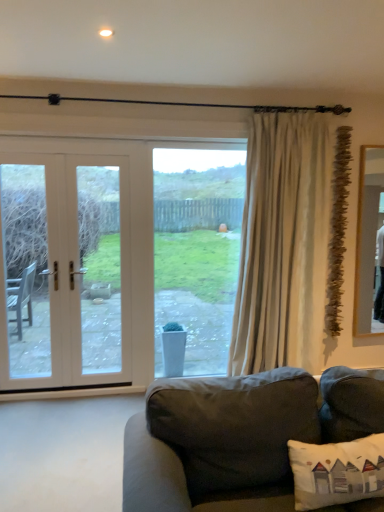
Question: Is clear glass window at center positioned in front of white wood door at left?

Choices:
 (A) no
 (B) yes

Answer: (A)

Question: Could you tell me if clear glass window at center is turned towards white wood door at left?

Choices:
 (A) yes
 (B) no

Answer: (B)

Question: Can you confirm if clear glass window at center is positioned to the right of white wood door at left?

Choices:
 (A) yes
 (B) no

Answer: (A)

Question: Considering the relative sizes of clear glass window at center and white wood door at left in the image provided, is clear glass window at center thinner than white wood door at left?

Choices:
 (A) yes
 (B) no

Answer: (A)

Question: From a real-world perspective, is clear glass window at center over white wood door at left?

Choices:
 (A) yes
 (B) no

Answer: (B)

Question: Looking at the image, does white wood door at left seem bigger or smaller compared to dark gray fabric couch at lower center?

Choices:
 (A) small
 (B) big

Answer: (A)

Question: In the image, is white wood door at left positioned in front of or behind dark gray fabric couch at lower center?

Choices:
 (A) behind
 (B) front

Answer: (A)

Question: Is white wood door at left to the left or to the right of dark gray fabric couch at lower center in the image?

Choices:
 (A) left
 (B) right

Answer: (A)

Question: Considering the positions of white wood door at left and dark gray fabric couch at lower center in the image, is white wood door at left wider or thinner than dark gray fabric couch at lower center?

Choices:
 (A) thin
 (B) wide

Answer: (A)

Question: Would you say clear glass window at center is inside or outside beige fabric curtain at right?

Choices:
 (A) outside
 (B) inside

Answer: (A)

Question: Relative to beige fabric curtain at right, is clear glass window at center in front or behind?

Choices:
 (A) front
 (B) behind

Answer: (B)

Question: Is clear glass window at center to the left or to the right of beige fabric curtain at right in the image?

Choices:
 (A) right
 (B) left

Answer: (B)

Question: Is clear glass window at center taller or shorter than beige fabric curtain at right?

Choices:
 (A) short
 (B) tall

Answer: (A)

Question: From a real-world perspective, is dark gray fabric couch at lower center physically located above or below white fabric pillow at lower right?

Choices:
 (A) below
 (B) above

Answer: (A)

Question: In terms of height, does dark gray fabric couch at lower center look taller or shorter compared to white fabric pillow at lower right?

Choices:
 (A) tall
 (B) short

Answer: (A)